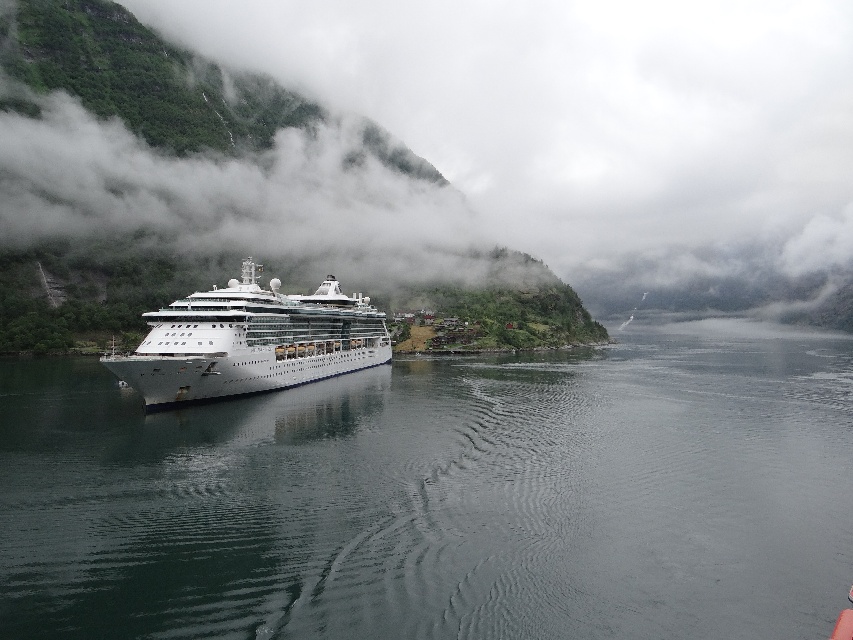
What do you see at coordinates (442, 497) in the screenshot? The width and height of the screenshot is (853, 640). I see `clear water at center` at bounding box center [442, 497].

Is point (318, 572) positioned in front of point (142, 51)?

Yes, point (318, 572) is closer to viewer.

Locate an element on the screen. The height and width of the screenshot is (640, 853). clear water at center is located at coordinates (442, 497).

Who is positioned more to the left, green matte mountain at left or white glossy cruise ship at center?

Positioned to the left is green matte mountain at left.

Which is in front, point (409, 257) or point (316, 323)?

Positioned in front is point (316, 323).

Is point (175, 92) positioned after point (354, 298)?

Yes, point (175, 92) is behind point (354, 298).

At what (x,y) coordinates should I click in order to perform the action: click on green matte mountain at left. Please return your answer as a coordinate pair (x, y). The image size is (853, 640). Looking at the image, I should click on (219, 195).

Is clear water at center positioned before white glossy cruise ship at center?

Yes, clear water at center is in front of white glossy cruise ship at center.

Between clear water at center and white glossy cruise ship at center, which one appears on the left side from the viewer's perspective?

From the viewer's perspective, white glossy cruise ship at center appears more on the left side.

Where is `clear water at center`? clear water at center is located at coordinates (442, 497).